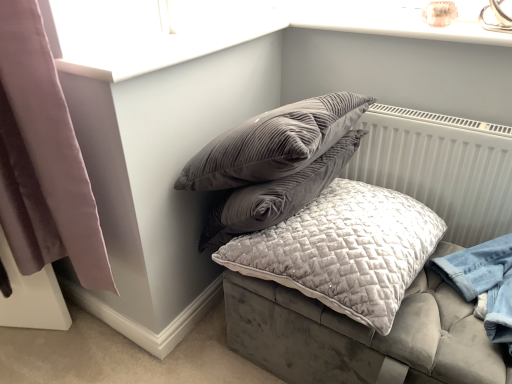
This screenshot has height=384, width=512. What do you see at coordinates (441, 167) in the screenshot?
I see `white textured radiator at upper right` at bounding box center [441, 167].

The width and height of the screenshot is (512, 384). What are the coordinates of `mauve velvet curtain at left` in the screenshot? It's located at 42,158.

Describe the element at coordinates (344, 250) in the screenshot. This screenshot has width=512, height=384. I see `velvet quilted pillow at center` at that location.

This screenshot has height=384, width=512. What are the coordinates of `velvet grey cushion at center` in the screenshot? It's located at (361, 337).

Would you say mauve velvet curtain at left is outside white textured radiator at upper right?

Indeed, mauve velvet curtain at left is completely outside white textured radiator at upper right.

Which object is more forward, mauve velvet curtain at left or white textured radiator at upper right?

mauve velvet curtain at left is closer to the camera.

In terms of height, does mauve velvet curtain at left look taller or shorter compared to white textured radiator at upper right?

Clearly, mauve velvet curtain at left is taller compared to white textured radiator at upper right.

What's the angular difference between white textured radiator at upper right and velvet quilted pillow at center's facing directions?

There is a 0.00123-degree angle between the facing directions of white textured radiator at upper right and velvet quilted pillow at center.

Between white textured radiator at upper right and velvet quilted pillow at center, which one has less height?

Standing shorter between the two is velvet quilted pillow at center.

Would you say white textured radiator at upper right is to the left or to the right of velvet quilted pillow at center in the picture?

white textured radiator at upper right is positioned on velvet quilted pillow at center's right side.

Considering the sizes of white textured radiator at upper right and velvet quilted pillow at center in the image, is white textured radiator at upper right bigger or smaller than velvet quilted pillow at center?

Considering their sizes, white textured radiator at upper right takes up less space than velvet quilted pillow at center.

From a real-world perspective, between velvet grey cushion at center and white textured radiator at upper right, who is vertically lower?

velvet grey cushion at center is physically lower.

How far apart are velvet grey cushion at center and white textured radiator at upper right?

They are 12.36 centimeters apart.

Considering the points (402, 351) and (473, 194), which point is behind, point (402, 351) or point (473, 194)?

Positioned behind is point (473, 194).

Is velvet grey cushion at center outside of white textured radiator at upper right?

That's correct, velvet grey cushion at center is outside of white textured radiator at upper right.

Is mauve velvet curtain at left positioned with its back to velvet quilted pillow at center?

No, mauve velvet curtain at left's orientation is not away from velvet quilted pillow at center.

Would you say mauve velvet curtain at left contains velvet quilted pillow at center?

No, mauve velvet curtain at left does not contain velvet quilted pillow at center.

Does mauve velvet curtain at left have a lesser width compared to velvet quilted pillow at center?

→ Yes.

From the picture: From a real-world perspective, which is physically above, mauve velvet curtain at left or velvet quilted pillow at center?

From a 3D spatial view, mauve velvet curtain at left is above.

Are velvet grey cushion at center and mauve velvet curtain at left beside each other?

There is a gap between velvet grey cushion at center and mauve velvet curtain at left.

From the image's perspective, does velvet grey cushion at center appear higher than mauve velvet curtain at left?

No, from the image's perspective, velvet grey cushion at center is not over mauve velvet curtain at left.

Who is shorter, velvet grey cushion at center or mauve velvet curtain at left?

Standing shorter between the two is velvet grey cushion at center.

At what (x,y) coordinates should I click in order to perform the action: click on curtain that is above the velvet grey cushion at center (from the image's perspective). Please return your answer as a coordinate pair (x, y). The width and height of the screenshot is (512, 384). Looking at the image, I should click on (42, 158).

Considering the sizes of objects mauve velvet curtain at left and velvet grey cushion at center in the image provided, who is thinner, mauve velvet curtain at left or velvet grey cushion at center?

mauve velvet curtain at left is thinner.

Is mauve velvet curtain at left at the right side of velvet grey cushion at center?

Incorrect, mauve velvet curtain at left is not on the right side of velvet grey cushion at center.

Who is bigger, mauve velvet curtain at left or velvet grey cushion at center?

With larger size is velvet grey cushion at center.

Is mauve velvet curtain at left next to velvet grey cushion at center and touching it?

No, mauve velvet curtain at left is not making contact with velvet grey cushion at center.

Considering the positions of objects velvet quilted pillow at center and velvet grey cushion at center in the image provided, who is more to the left, velvet quilted pillow at center or velvet grey cushion at center?

velvet quilted pillow at center.

Is velvet quilted pillow at center positioned with its back to velvet grey cushion at center?

No, velvet quilted pillow at center is not facing the opposite direction of velvet grey cushion at center.

Looking at this image, looking at their sizes, would you say velvet quilted pillow at center is wider or thinner than velvet grey cushion at center?

velvet quilted pillow at center is thinner than velvet grey cushion at center.

This screenshot has height=384, width=512. Identify the location of curtain that is in front of the white textured radiator at upper right. (42, 158).

Locate an element on the screen. This screenshot has height=384, width=512. pillow below the white textured radiator at upper right (from the image's perspective) is located at coordinates (344, 250).

Looking at the image, which one is located closer to velvet grey cushion at center, mauve velvet curtain at left or white textured radiator at upper right?

Among the two, white textured radiator at upper right is located nearer to velvet grey cushion at center.

Looking at the image, which one is located further to white textured radiator at upper right, velvet quilted pillow at center or velvet grey cushion at center?

velvet quilted pillow at center is further to white textured radiator at upper right.

When comparing their distances from velvet quilted pillow at center, does mauve velvet curtain at left or white textured radiator at upper right seem closer?

white textured radiator at upper right.

Looking at this image, from the image, which object appears to be farther from white textured radiator at upper right, mauve velvet curtain at left or velvet quilted pillow at center?

The object further to white textured radiator at upper right is mauve velvet curtain at left.

Which object lies further to the anchor point velvet quilted pillow at center, white textured radiator at upper right or mauve velvet curtain at left?

mauve velvet curtain at left lies further to velvet quilted pillow at center than the other object.

Estimate the real-world distances between objects in this image. Which object is further from velvet quilted pillow at center, velvet grey cushion at center or white textured radiator at upper right?

Among the two, white textured radiator at upper right is located further to velvet quilted pillow at center.

In the scene shown: Considering their positions, is white textured radiator at upper right positioned further to velvet quilted pillow at center than velvet grey cushion at center?

white textured radiator at upper right.

Considering their positions, is velvet quilted pillow at center positioned further to mauve velvet curtain at left than white textured radiator at upper right?

The object further to mauve velvet curtain at left is white textured radiator at upper right.

This screenshot has width=512, height=384. I want to click on pillow located between mauve velvet curtain at left and velvet grey cushion at center in the left-right direction, so click(344, 250).

I want to click on pillow that lies between white textured radiator at upper right and velvet grey cushion at center from top to bottom, so (344, 250).

In order to click on bed between mauve velvet curtain at left and white textured radiator at upper right in this screenshot , I will do `click(361, 337)`.

Locate an element on the screen. The width and height of the screenshot is (512, 384). pillow between mauve velvet curtain at left and white textured radiator at upper right from left to right is located at coordinates (344, 250).